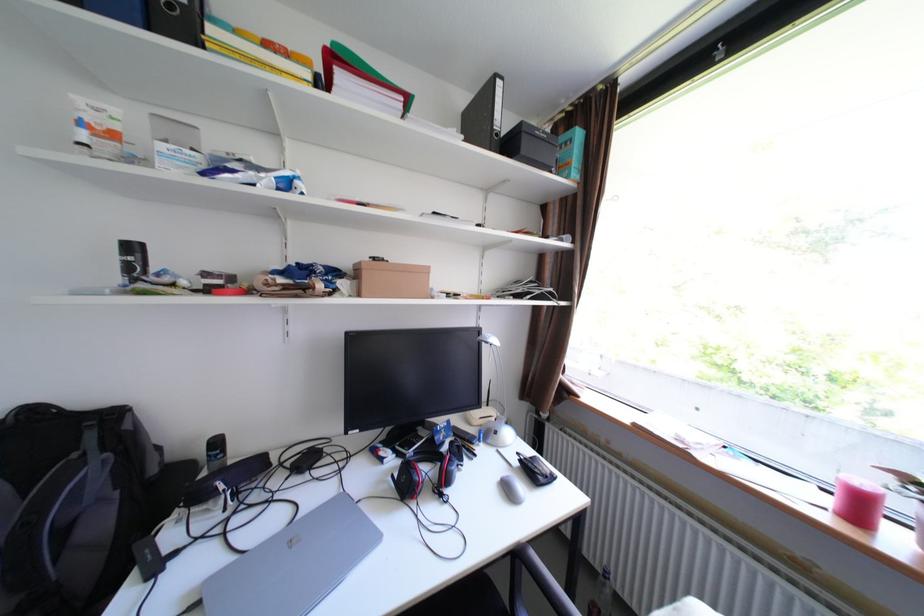
Where would you pull the backpack handle? Please return your answer as a coordinate pair (x, y).

(28, 408)